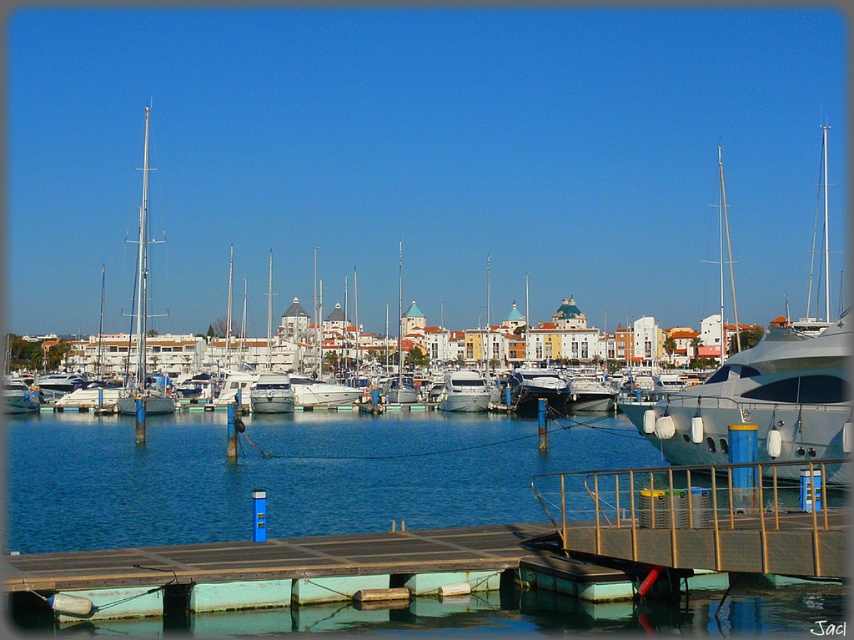
You are navigating a small boat in the marina and need to dock at the metallic gray dock at center. Based on the coordinates provided in the Objects Description, can you determine if the dock is positioned closer to the edge of the marina or near the center area?

The metallic gray dock at center is located at coordinates point (705, 516), which places it closer to the edge of the marina rather than the center area since the coordinates are both above 0.8, indicating proximity to the lower right corner of the image.

You are standing at the edge of the marina and want to locate the metallic gray dock at center. According to the coordinates provided, where would you look in the image?

The metallic gray dock at center is located at the coordinates point (705, 516) in the image.

You are standing on the deck of a boat anchored near the metallic gray dock at center and the silver metallic mast at left. Which object is positioned lower in the scene?

The metallic gray dock at center is located below the silver metallic mast at left, so it is positioned lower in the scene.